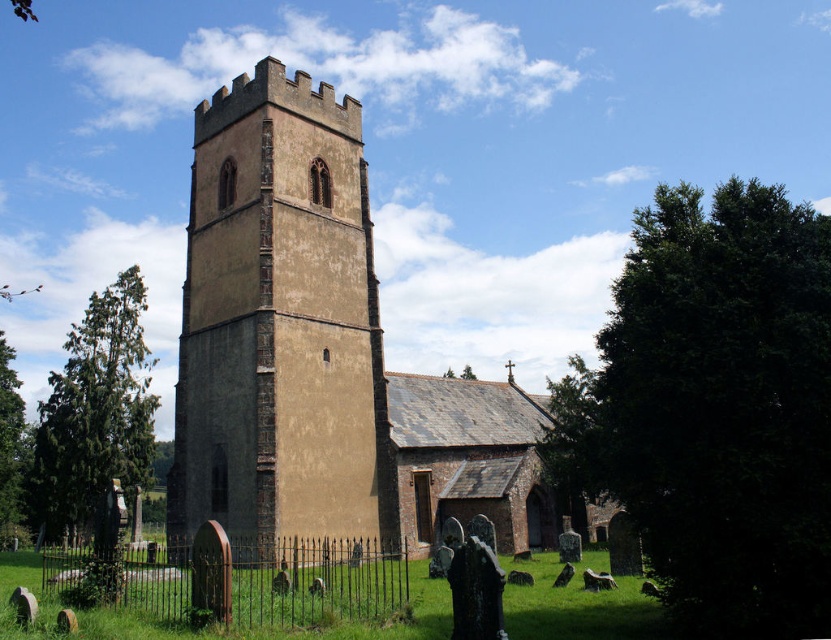
Question: Is brown stone church at center to the left of brown stone tower at center from the viewer's perspective?

Choices:
 (A) no
 (B) yes

Answer: (A)

Question: Which object is closer to the camera taking this photo?

Choices:
 (A) brown stone church at center
 (B) brown stone tower at center

Answer: (A)

Question: Can you confirm if brown stone church at center is smaller than brown stone tower at center?

Choices:
 (A) yes
 (B) no

Answer: (B)

Question: Is brown stone church at center in front of brown stone tower at center?

Choices:
 (A) yes
 (B) no

Answer: (A)

Question: Which point appears farthest from the camera in this image?

Choices:
 (A) [x=370, y=308]
 (B) [x=259, y=88]

Answer: (A)